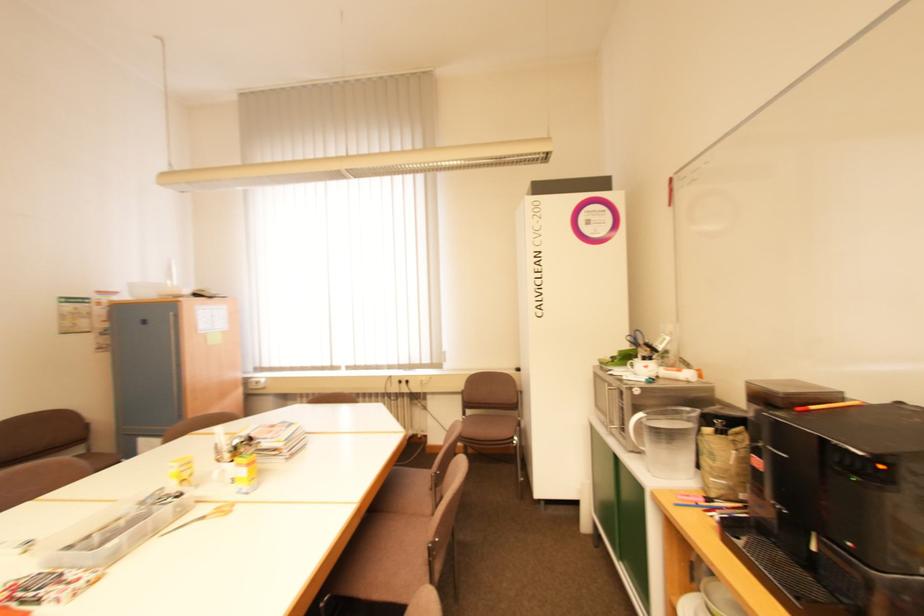
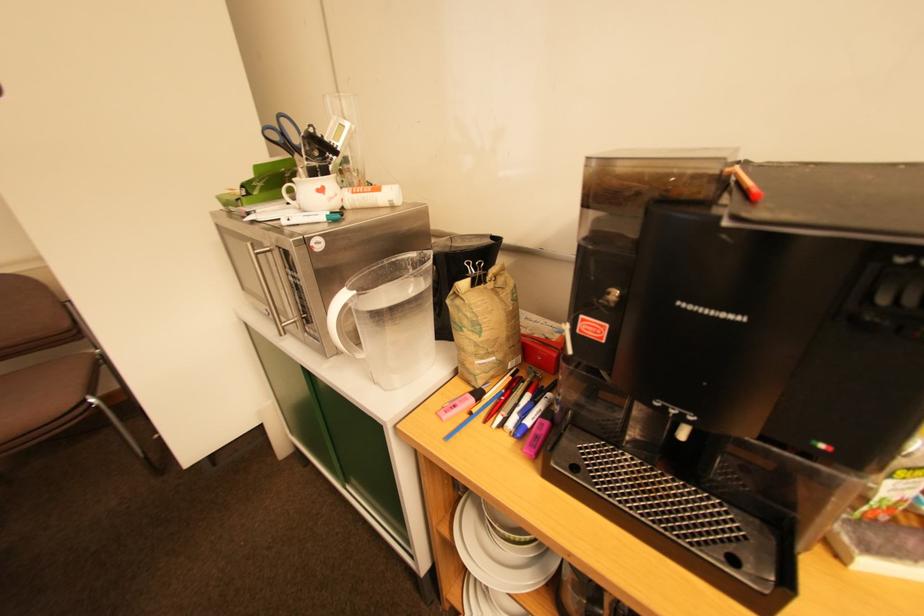
Based on the continuous images, in which direction is the camera rotating?

The camera rotated toward right-down.